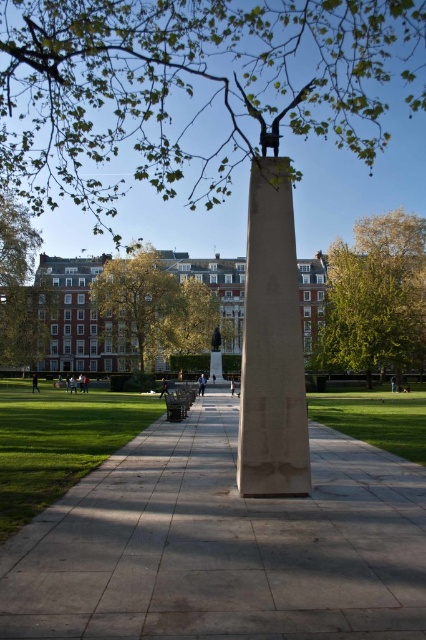
Question: Which point is closer to the camera?

Choices:
 (A) (397, 436)
 (B) (31, 497)

Answer: (B)

Question: Is gray concrete pavement at center above green leafy tree at center-left?

Choices:
 (A) no
 (B) yes

Answer: (A)

Question: Which object appears farthest from the camera in this image?

Choices:
 (A) beige stone obelisk at center
 (B) green leafy tree at center-left
 (C) wooden park bench at lower center

Answer: (B)

Question: Where is green leafy tree at right located in relation to green leafy tree at center-left in the image?

Choices:
 (A) left
 (B) right

Answer: (B)

Question: Is green grass at lower left above wooden park bench at lower center?

Choices:
 (A) yes
 (B) no

Answer: (B)

Question: Which point is closer to the camera taking this photo?

Choices:
 (A) (178, 401)
 (B) (152, 70)

Answer: (A)